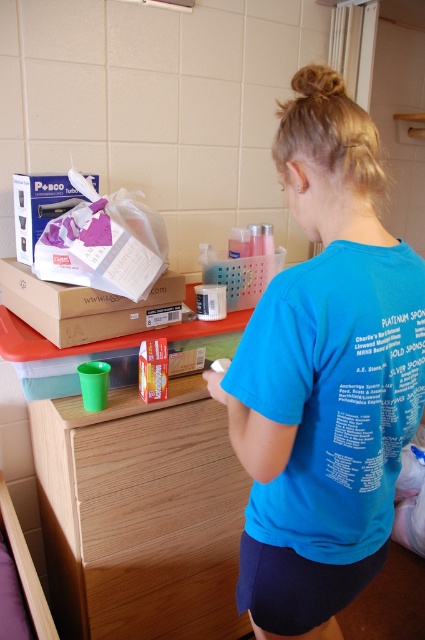
You are organizing items on a shelf and need to place both the matte cardboard box at upper left and the purple matte posco at upper left. Which item should you place first if you want to ensure there is enough space for both?

You should place the purple matte posco at upper left first because it is smaller in width than the matte cardboard box at upper left, allowing enough space for both items on the shelf.

You are a delivery person who just arrived at a utility room. You need to place a new purple matte posco at upper left and a braided hair at upper center. Based on the current setup, which object should you place first to avoid blocking the other?

The purple matte posco at upper left should be placed first because it is closer to the viewer than the braided hair at upper center, so placing it first would prevent blocking the other object.

You are a delivery person who needs to place a package between the purple matte posco at upper left and the braided hair at upper center. The package is 30 inches long. Can you fit it between them?

The distance between the purple matte posco at upper left and the braided hair at upper center is 28.86 inches, so the 30 inch package cannot fit between them as it is longer than the available space.